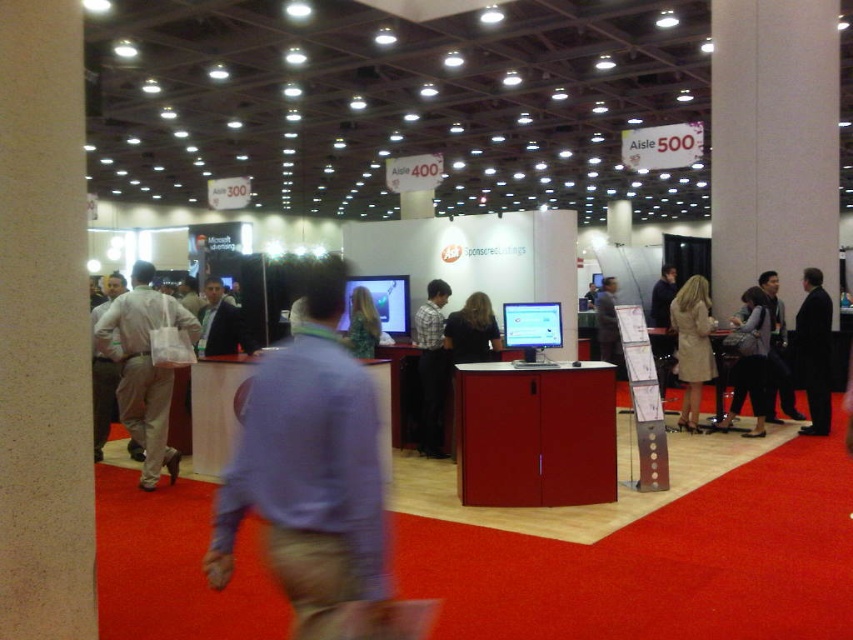
You are a GUI agent. You are given a task and a screenshot of the screen. Output one action in this format:
    pyautogui.click(x=<x>, y=<y>)
    Task: Click on the purple shirt at center
    
    Given the screenshot: What is the action you would take?
    pyautogui.click(x=311, y=474)

Does purple shirt at center appear over light beige coat at right?

Indeed, purple shirt at center is positioned over light beige coat at right.

Between point (376, 401) and point (679, 413), which one is positioned in front?

Point (376, 401) is in front.

Locate an element on the screen. The height and width of the screenshot is (640, 853). purple shirt at center is located at coordinates (311, 474).

Between point (138, 435) and point (746, 340), which one is positioned in front?

Point (138, 435) is in front.

You are a GUI agent. You are given a task and a screenshot of the screen. Output one action in this format:
    pyautogui.click(x=<x>, y=<y>)
    Task: Click on the white fabric bag at left
    This screenshot has width=853, height=640.
    Given the screenshot: What is the action you would take?
    (144, 365)

Is light beige coat at right behind light beige fabric bag at left?

Yes.

Is point (682, 326) closer to camera compared to point (100, 419)?

That is False.

Describe the element at coordinates (692, 346) in the screenshot. The width and height of the screenshot is (853, 640). I see `light beige coat at right` at that location.

Where is `light beige coat at right`? Image resolution: width=853 pixels, height=640 pixels. light beige coat at right is located at coordinates (692, 346).